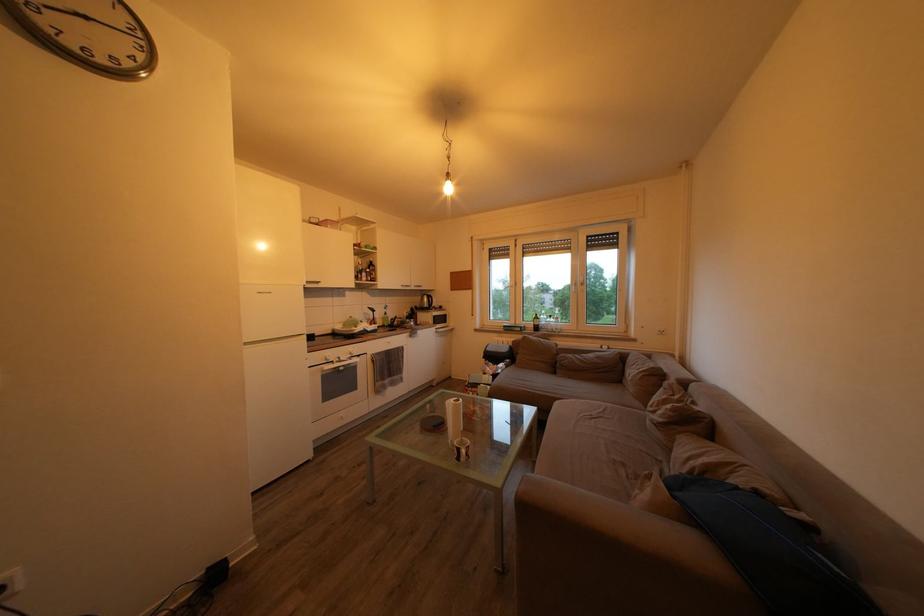
Find where to pull the silver cabinet handle. Please return your answer as a coordinate pair (x, y).

(444, 331)